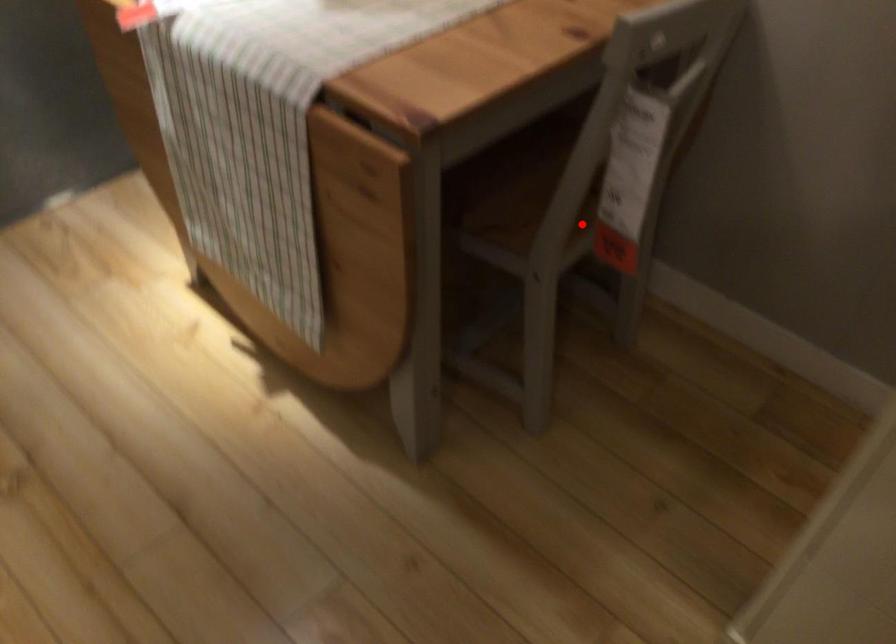
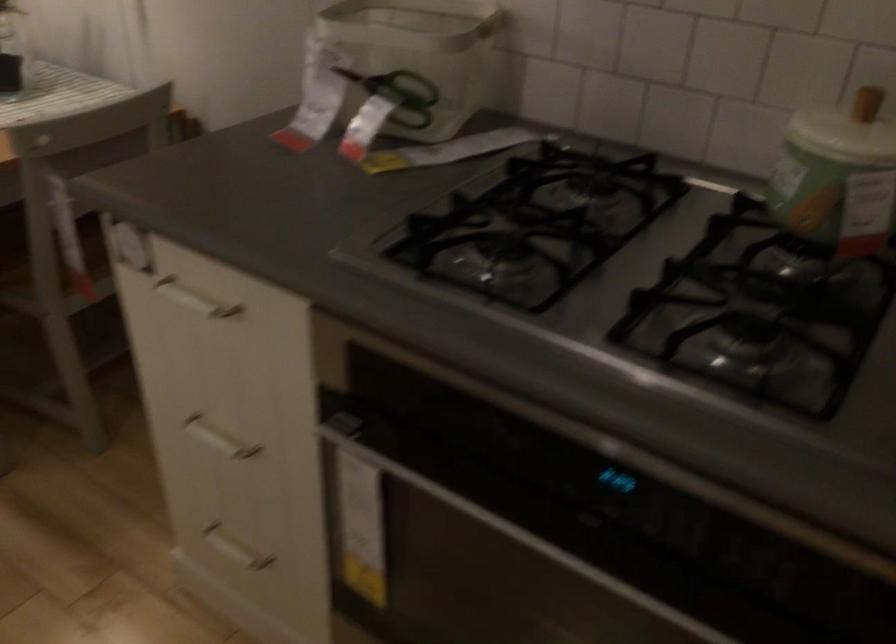
Question: I am providing you with two images of the same scene from different viewpoints. A red point is shown in image1. For the corresponding object point in image2, is it positioned nearer or farther from the camera?

Choices:
 (A) Nearer
 (B) Farther

Answer: (B)